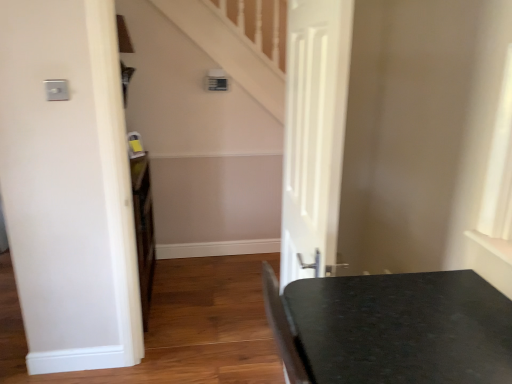
Question: Looking at their shapes, would you say black granite table at lower right is wider or thinner than white matte door at center?

Choices:
 (A) wide
 (B) thin

Answer: (A)

Question: From the image's perspective, is black granite table at lower right located above or below white matte door at center?

Choices:
 (A) below
 (B) above

Answer: (A)

Question: In the image, is black granite table at lower right positioned in front of or behind white matte door at center?

Choices:
 (A) front
 (B) behind

Answer: (A)

Question: In terms of height, does white matte door at center look taller or shorter compared to black granite table at lower right?

Choices:
 (A) short
 (B) tall

Answer: (B)

Question: Visually, is white matte door at center positioned to the left or to the right of black granite table at lower right?

Choices:
 (A) right
 (B) left

Answer: (B)

Question: Considering their positions, is white matte door at center located in front of or behind black granite table at lower right?

Choices:
 (A) front
 (B) behind

Answer: (B)

Question: From a real-world perspective, is white matte door at center physically located above or below black granite table at lower right?

Choices:
 (A) below
 (B) above

Answer: (A)